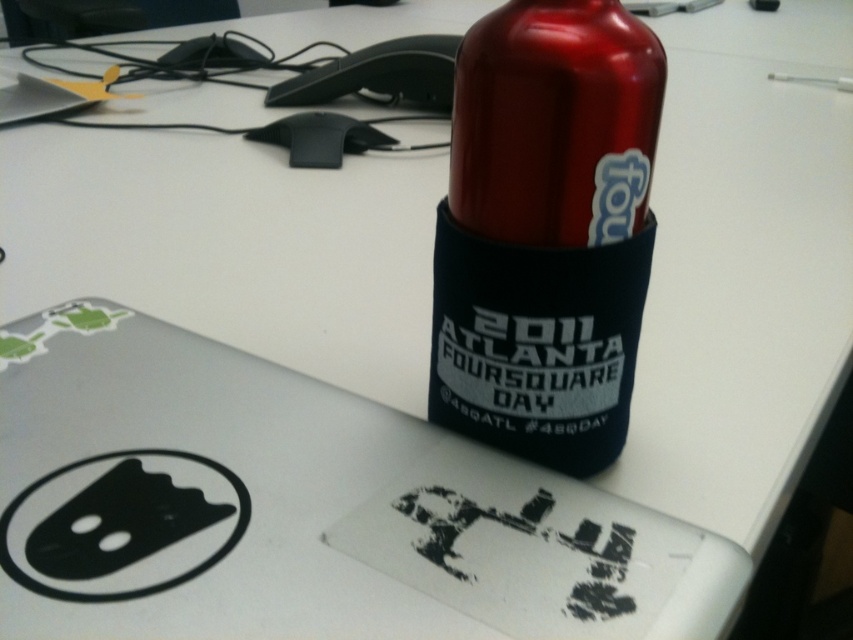
Can you confirm if silver metallic laptop at upper center is positioned to the left of metallic red bottle at upper right?

Indeed, silver metallic laptop at upper center is positioned on the left side of metallic red bottle at upper right.

Is silver metallic laptop at upper center thinner than metallic red bottle at upper right?

In fact, silver metallic laptop at upper center might be wider than metallic red bottle at upper right.

I want to click on silver metallic laptop at upper center, so click(299, 508).

The image size is (853, 640). In order to click on silver metallic laptop at upper center in this screenshot , I will do `click(299, 508)`.

Which of these two, metallic red bottle at upper right or matte white sticker at bottle top, stands taller?

With more height is metallic red bottle at upper right.

Between metallic red bottle at upper right and matte white sticker at bottle top, which one appears on the right side from the viewer's perspective?

Positioned to the right is matte white sticker at bottle top.

Measure the distance between point (611, 4) and camera.

Point (611, 4) and camera are 13.18 inches apart.

Locate an element on the screen. metallic red bottle at upper right is located at coordinates (546, 230).

Describe the element at coordinates (299, 508) in the screenshot. I see `silver metallic laptop at upper center` at that location.

Does silver metallic laptop at upper center appear under matte white sticker at bottle top?

Yes, silver metallic laptop at upper center is below matte white sticker at bottle top.

Describe the element at coordinates (299, 508) in the screenshot. The image size is (853, 640). I see `silver metallic laptop at upper center` at that location.

You are a GUI agent. You are given a task and a screenshot of the screen. Output one action in this format:
    pyautogui.click(x=<x>, y=<y>)
    Task: Click on the silver metallic laptop at upper center
    The height and width of the screenshot is (640, 853).
    Given the screenshot: What is the action you would take?
    pyautogui.click(x=299, y=508)